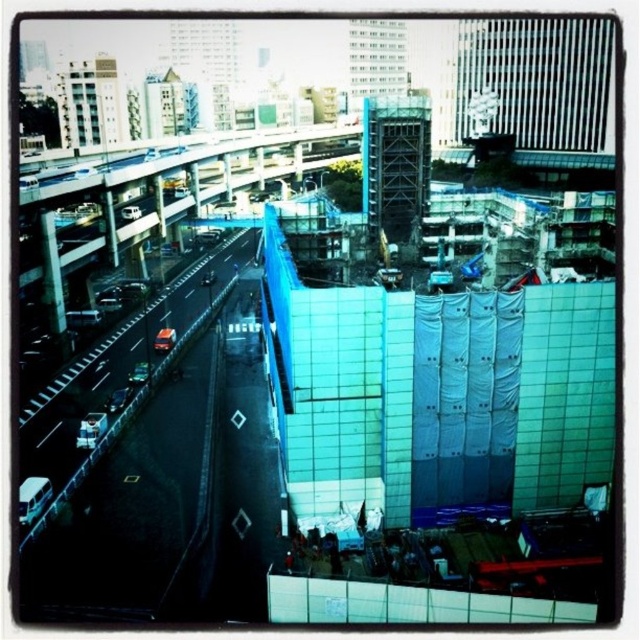
Question: Is black asphalt highway at left to the right of blue glass overpass at center from the viewer's perspective?

Choices:
 (A) no
 (B) yes

Answer: (B)

Question: Among these objects, which one is nearest to the camera?

Choices:
 (A) black asphalt highway at left
 (B) blue glass overpass at center

Answer: (A)

Question: Does black asphalt highway at left have a lesser width compared to blue glass overpass at center?

Choices:
 (A) no
 (B) yes

Answer: (B)

Question: Observing the image, what is the correct spatial positioning of black asphalt highway at left in reference to blue glass overpass at center?

Choices:
 (A) right
 (B) left

Answer: (A)

Question: Among these points, which one is farthest from the camera?

Choices:
 (A) (122, 429)
 (B) (305, 177)

Answer: (B)